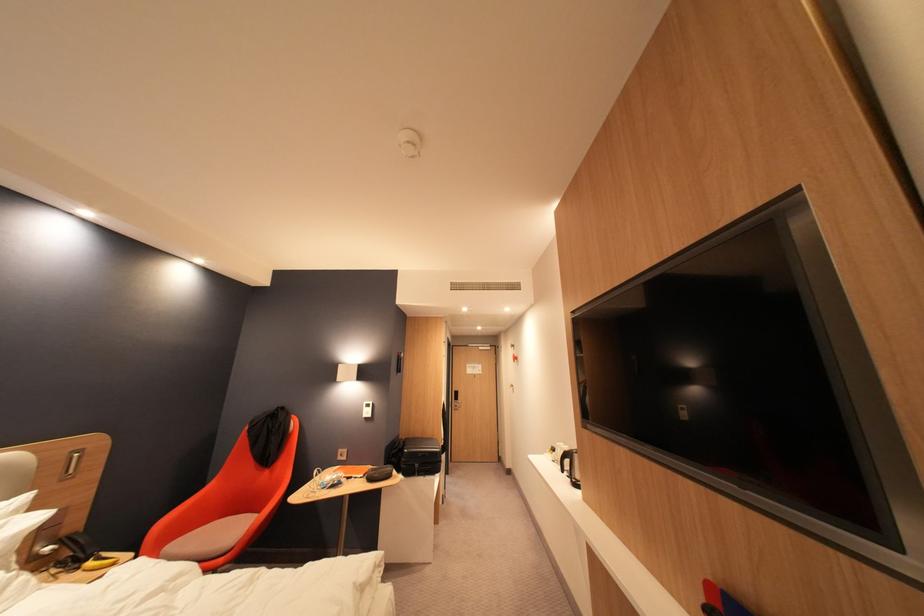
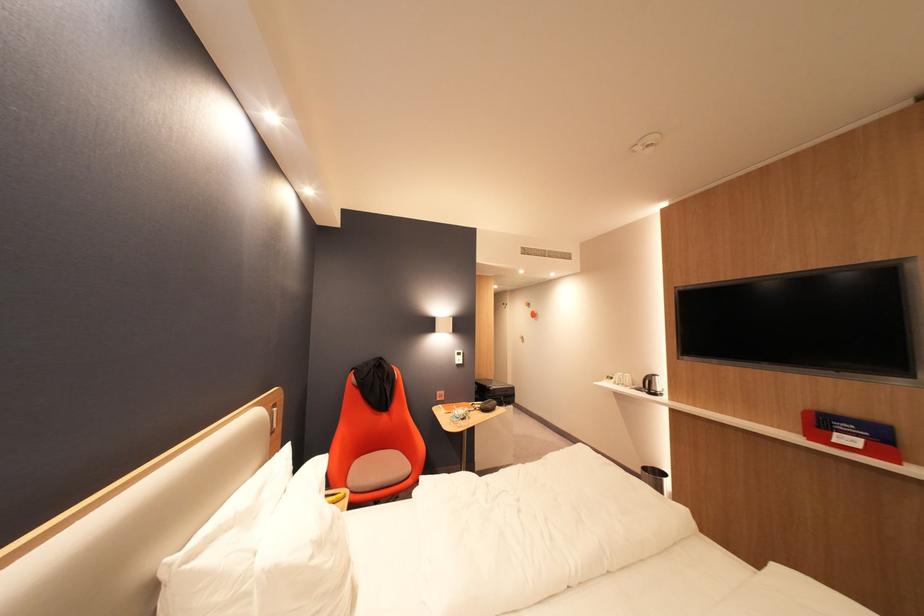
Find the pixel in the second image that matches point 416,453 in the first image.

(502, 390)